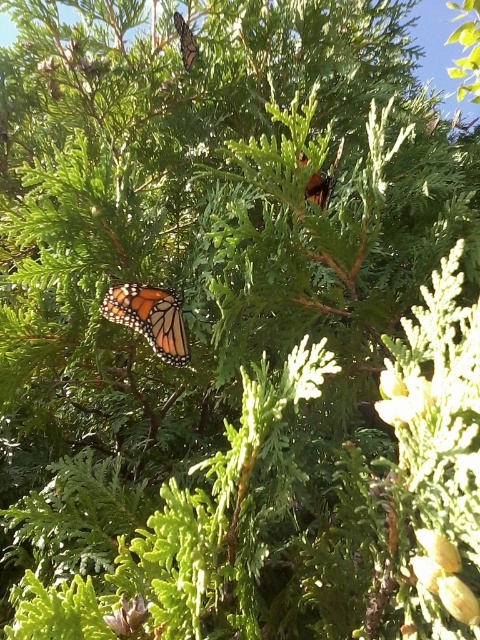
Which of these two, orange and black spotted butterfly at center or orange and black spotted butterfly at upper center, stands taller?

With more height is orange and black spotted butterfly at center.

Which of these two, orange and black spotted butterfly at center or orange and black spotted butterfly at upper center, stands shorter?

orange and black spotted butterfly at upper center

Does point (176, 356) come closer to viewer compared to point (178, 33)?

Yes.

This screenshot has height=640, width=480. What are the coordinates of `orange and black spotted butterfly at center` in the screenshot? It's located at (149, 317).